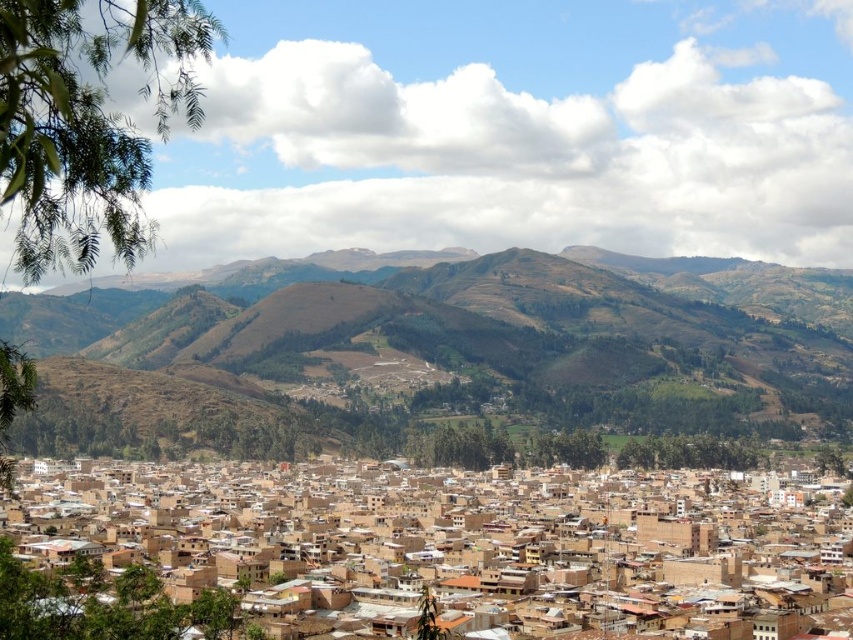
Question: Can you confirm if brown clay buildings at center is bigger than brown textured hillside at center?

Choices:
 (A) no
 (B) yes

Answer: (B)

Question: Which of the following is the farthest from the observer?

Choices:
 (A) brown clay buildings at center
 (B) brown textured hillside at center

Answer: (B)

Question: Which point is farther to the camera?

Choices:
 (A) brown clay buildings at center
 (B) brown textured hillside at center

Answer: (B)

Question: Considering the relative positions of brown clay buildings at center and brown textured hillside at center in the image provided, where is brown clay buildings at center located with respect to brown textured hillside at center?

Choices:
 (A) above
 (B) below

Answer: (B)

Question: Is brown clay buildings at center in front of brown textured hillside at center?

Choices:
 (A) yes
 (B) no

Answer: (A)

Question: Which point is farther to the camera?

Choices:
 (A) brown clay buildings at center
 (B) brown textured hillside at center

Answer: (B)